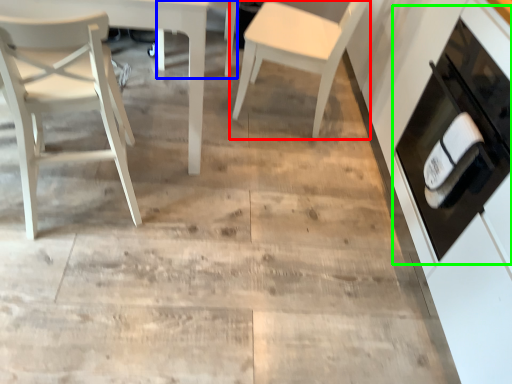
Question: Which object is positioned closest to chair (highlighted by a red box)? Select from chair (highlighted by a blue box) and cabinetry (highlighted by a green box).

Choices:
 (A) chair
 (B) cabinetry

Answer: (A)